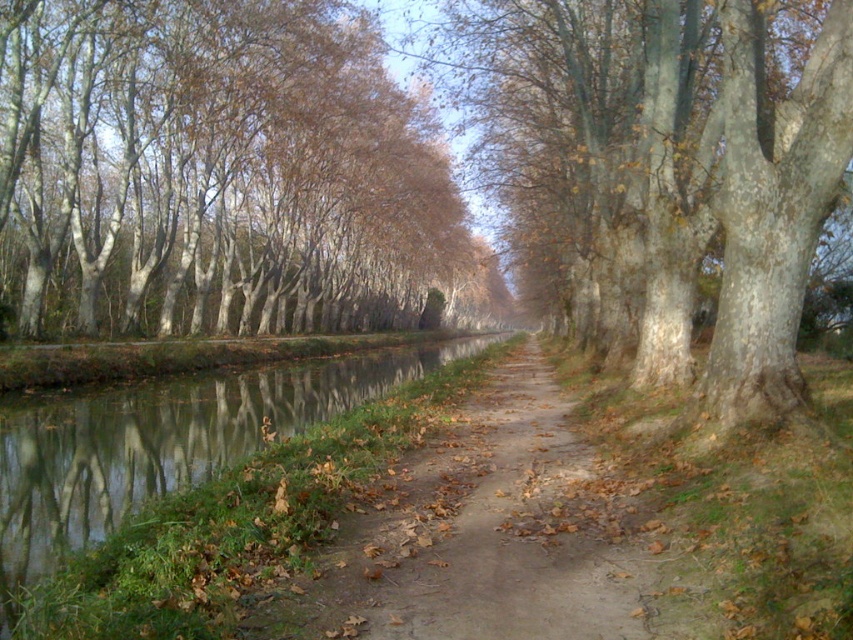
In the scene shown: You are standing on the brown dirt path at center and want to reach the green reflective water at center. Can you step directly from the path to the water?

The brown dirt path at center is above green reflective water at center, so you can step directly from the path to the water since they are adjacent.

Looking at this image, you are standing at the point marked as point (485, 536) in the image. What is the object directly beneath your feet?

The brown dirt path at center is located at point (485, 536), so the object directly beneath your feet is the brown dirt path at center.

You are a hiker standing on the path between the green reflective water at center and the smooth gray bark tree at center. You want to place a 15 feet long bench between them. Will the bench fit without overlapping either object?

The distance between the green reflective water at center and the smooth gray bark tree at center is 20.07 feet. Since the bench is 15 feet long, it will fit between them without overlapping either object as there is enough space.